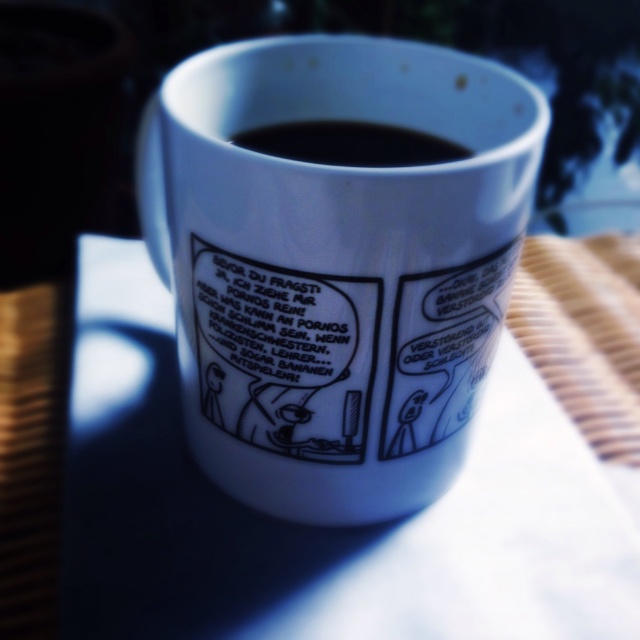
Is the position of white fabric at upper center more distant than that of black glossy coffee at upper center?

No, white fabric at upper center is in front of black glossy coffee at upper center.

Is white fabric at upper center thinner than black glossy coffee at upper center?

No, white fabric at upper center is not thinner than black glossy coffee at upper center.

Is point (340, 573) less distant than point (332, 157)?

Yes.

Locate an element on the screen. white fabric at upper center is located at coordinates (323, 528).

Between white glossy mug at center and black glossy coffee at upper center, which one has more height?

With more height is white glossy mug at center.

Is point (164, 125) positioned before point (412, 141)?

Yes, it is in front of point (412, 141).

The width and height of the screenshot is (640, 640). What are the coordinates of `white glossy mug at center` in the screenshot? It's located at (336, 266).

Which is in front, point (529, 83) or point (568, 593)?

Point (529, 83)

Image resolution: width=640 pixels, height=640 pixels. I want to click on white glossy mug at center, so click(x=336, y=266).